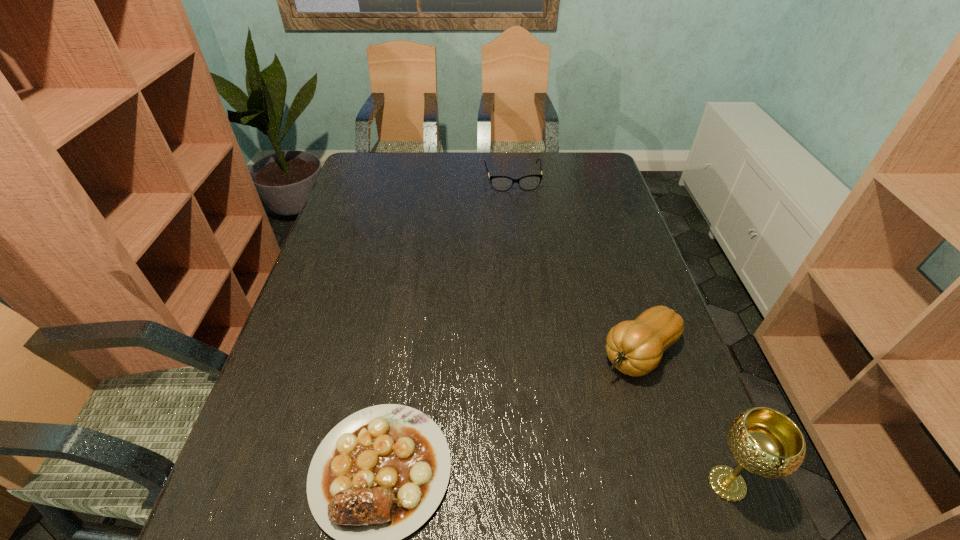
Locate an element on the screen. The image size is (960, 540). the tallest object is located at coordinates (767, 443).

Locate an element on the screen. gourd is located at coordinates (635, 347).

At what (x,y) coordinates should I click in order to perform the action: click on the second farthest object. Please return your answer as a coordinate pair (x, y). Looking at the image, I should click on (635, 347).

Locate an element on the screen. the second object from left to right is located at coordinates (530, 182).

Locate an element on the screen. spectacles is located at coordinates (530, 182).

Locate an element on the screen. The width and height of the screenshot is (960, 540). vacant point located on the left of the tallest object is located at coordinates (617, 483).

Locate an element on the screen. vacant space located on the stem side of the second tallest object is located at coordinates (484, 488).

The height and width of the screenshot is (540, 960). Find the location of `free space located on the stem side of the second tallest object`. free space located on the stem side of the second tallest object is located at coordinates (589, 395).

Locate an element on the screen. The image size is (960, 540). free space located 0.100m on the stem side of the second tallest object is located at coordinates (584, 400).

You are a GUI agent. You are given a task and a screenshot of the screen. Output one action in this format:
    pyautogui.click(x=<x>, y=<y>)
    Task: Click on the vacant space located 0.220m on the front-facing side of the spectacles
    
    Given the screenshot: What is the action you would take?
    pyautogui.click(x=523, y=232)